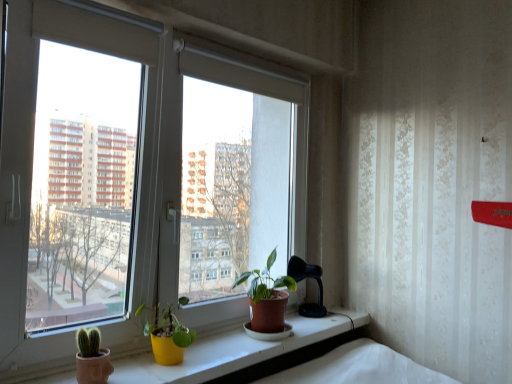
Question: Is matte brown pot at center, the second houseplant positioned from the front, directly adjacent to white plastic window at center?

Choices:
 (A) no
 (B) yes

Answer: (A)

Question: Would you say white plastic window at center is part of matte brown pot at center, positioned as the 2th houseplant in left-to-right order,'s contents?

Choices:
 (A) no
 (B) yes

Answer: (A)

Question: Can you confirm if matte brown pot at center, the second houseplant positioned from the front, is positioned to the right of white plastic window at center?

Choices:
 (A) no
 (B) yes

Answer: (B)

Question: Is matte brown pot at center, placed as the first houseplant when sorted from right to left, facing towards white plastic window at center?

Choices:
 (A) no
 (B) yes

Answer: (A)

Question: Is matte brown pot at center, positioned as the 2th houseplant in left-to-right order, at the left side of white plastic window at center?

Choices:
 (A) no
 (B) yes

Answer: (A)

Question: From a real-world perspective, is white plastic window at center positioned above or below matte brown pot at center, positioned as the 2th houseplant in left-to-right order?

Choices:
 (A) below
 (B) above

Answer: (B)

Question: From their relative heights in the image, would you say white plastic window at center is taller or shorter than matte brown pot at center, the second houseplant positioned from the front?

Choices:
 (A) tall
 (B) short

Answer: (A)

Question: Considering their positions, is white plastic window at center located in front of or behind matte brown pot at center, positioned as the 2th houseplant in left-to-right order?

Choices:
 (A) behind
 (B) front

Answer: (B)

Question: From the image's perspective, is white plastic window at center located above or below matte brown pot at center, placed as the first houseplant when sorted from right to left?

Choices:
 (A) below
 (B) above

Answer: (B)

Question: Is matte brown pot at center, positioned as the 2th houseplant in left-to-right order, taller or shorter than yellow matte pot at lower center, the 1th houseplant when ordered from left to right?

Choices:
 (A) tall
 (B) short

Answer: (A)

Question: From the image's perspective, relative to yellow matte pot at lower center, the second houseplant in the right-to-left sequence, is matte brown pot at center, positioned as the 1th houseplant in back-to-front order, above or below?

Choices:
 (A) above
 (B) below

Answer: (A)

Question: Considering the relative positions of matte brown pot at center, positioned as the 2th houseplant in left-to-right order, and yellow matte pot at lower center, the second houseplant in the right-to-left sequence, in the image provided, is matte brown pot at center, positioned as the 2th houseplant in left-to-right order, to the left or to the right of yellow matte pot at lower center, the second houseplant in the right-to-left sequence,?

Choices:
 (A) right
 (B) left

Answer: (A)

Question: Is point (292, 289) closer or farther from the camera than point (139, 312)?

Choices:
 (A) farther
 (B) closer

Answer: (A)

Question: Would you say yellow matte pot at lower center, which ranks as the second houseplant in back-to-front order, is inside or outside matte yellow pot at center?

Choices:
 (A) outside
 (B) inside

Answer: (A)

Question: In terms of size, does yellow matte pot at lower center, the second houseplant in the right-to-left sequence, appear bigger or smaller than matte yellow pot at center?

Choices:
 (A) small
 (B) big

Answer: (A)